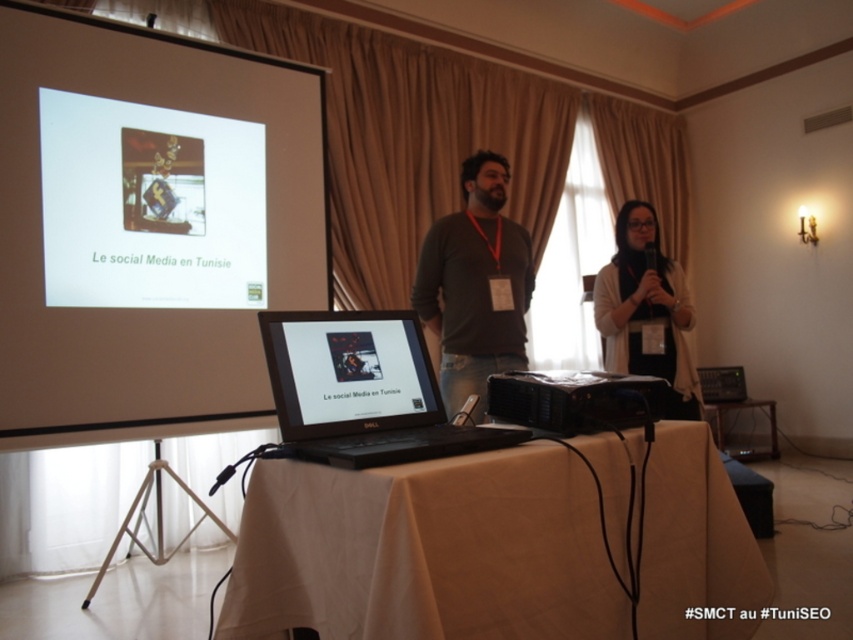
A presenter is standing at point (424, 419) and wants to reach the projector screen without stepping on the table. What is the minimum distance they need to walk?

The minimum distance the presenter needs to walk is 1.68 meters to reach the projector screen from point (424, 419) without stepping on the table.

You are a presenter who needs to adjust the height of your laptop to match the projector screen. Based on the scene, which object is taller and requires you to raise or lower the black matte laptop at center to align with the white matte projection screen at upper left?

The white matte projection screen at upper left is taller than the black matte laptop at center. To align them, you should raise the black matte laptop at center to match the height of the white matte projection screen at upper left.